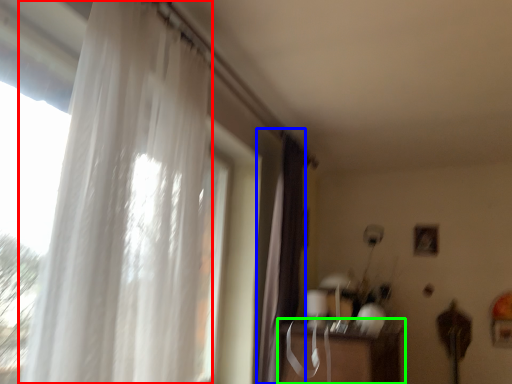
Question: Which is farther away from curtain (highlighted by a red box)? curtain (highlighted by a blue box) or table (highlighted by a green box)?

Choices:
 (A) curtain
 (B) table

Answer: (B)